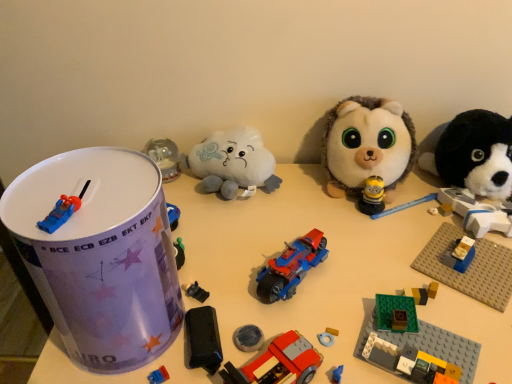
This screenshot has width=512, height=384. I want to click on free space underneath white plush cloud at center, which is the third toy in left-to-right order (from a real-world perspective), so click(x=196, y=187).